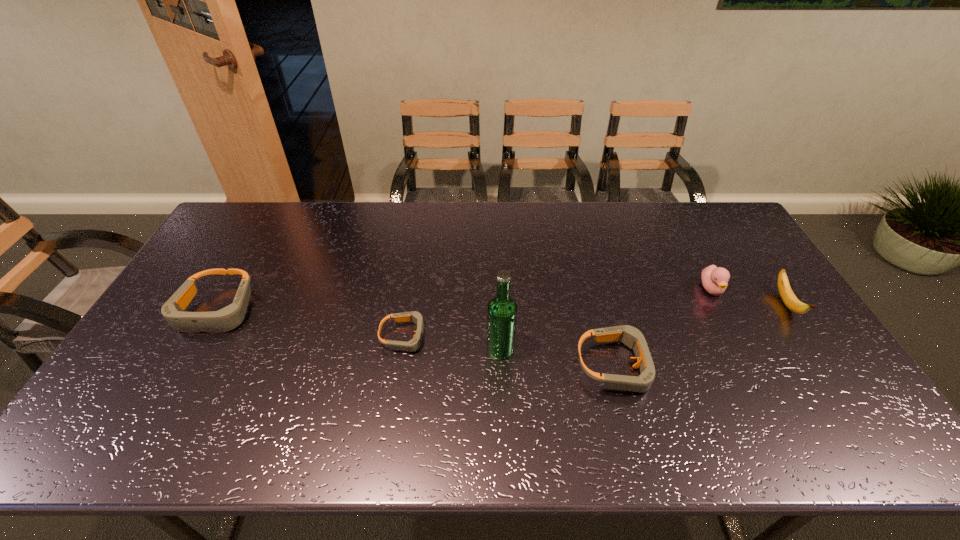
You are a GUI agent. You are given a task and a screenshot of the screen. Output one action in this format:
    pyautogui.click(x=<x>, y=<y>)
    Task: Click on the vacant region located 0.290m on the front and back of the second object from left to right
    This screenshot has height=540, width=960.
    Given the screenshot: What is the action you would take?
    pyautogui.click(x=533, y=336)

Locate an element on the screen. The width and height of the screenshot is (960, 540). vacant space located 0.050m on the front and back of the rightmost goggles is located at coordinates (675, 366).

This screenshot has width=960, height=540. Identify the location of vacant space located 0.100m at the stem of the rightmost object. (820, 354).

Where is `free space located on the front-facing side of the fifth object from left to right`? The image size is (960, 540). free space located on the front-facing side of the fifth object from left to right is located at coordinates (766, 393).

You are a GUI agent. You are given a task and a screenshot of the screen. Output one action in this format:
    pyautogui.click(x=<x>, y=<y>)
    Task: Click on the free region located 0.210m on the right of the third object from left to right
    The image size is (960, 540).
    Given the screenshot: What is the action you would take?
    pyautogui.click(x=590, y=349)

This screenshot has width=960, height=540. I want to click on object positioned at the near edge, so click(633, 338).

You are a GUI agent. You are given a task and a screenshot of the screen. Output one action in this format:
    pyautogui.click(x=<x>, y=<y>)
    Task: Click on the object that is at the left edge
    The height and width of the screenshot is (540, 960).
    Given the screenshot: What is the action you would take?
    pyautogui.click(x=228, y=318)

Image resolution: width=960 pixels, height=540 pixels. Identify the location of object at the right edge. [788, 297].

In the image, there is a desktop. Identify the location of vacant space at the far edge. (370, 202).

I want to click on vacant space at the near edge, so click(544, 397).